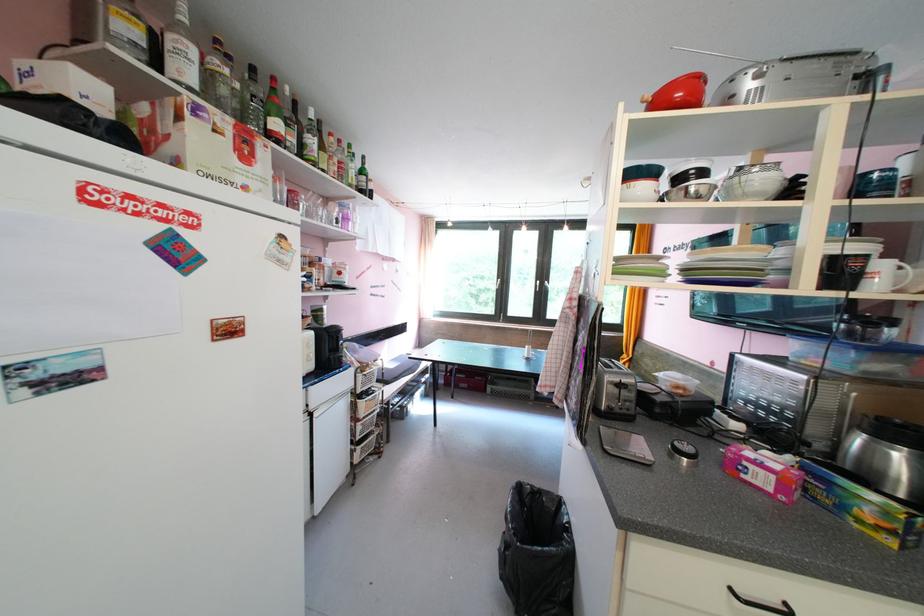
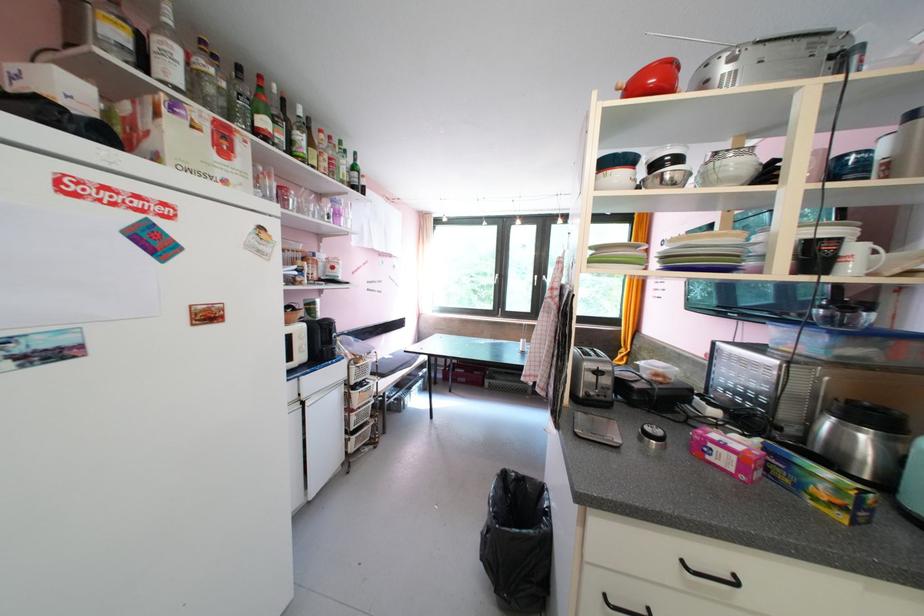
Locate, in the second image, the point that corresponds to [286,127] in the first image.

(273, 124)